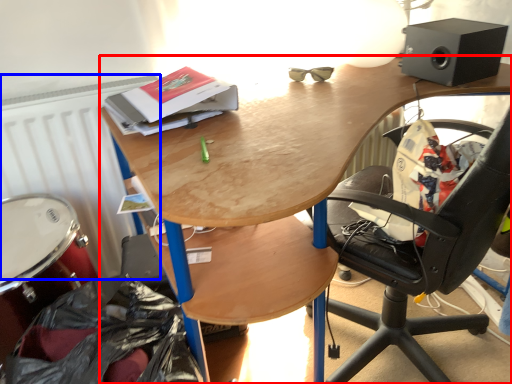
Question: Among these objects, which one is farthest to the camera, desk (highlighted by a red box) or radiator (highlighted by a blue box)?

Choices:
 (A) desk
 (B) radiator

Answer: (B)